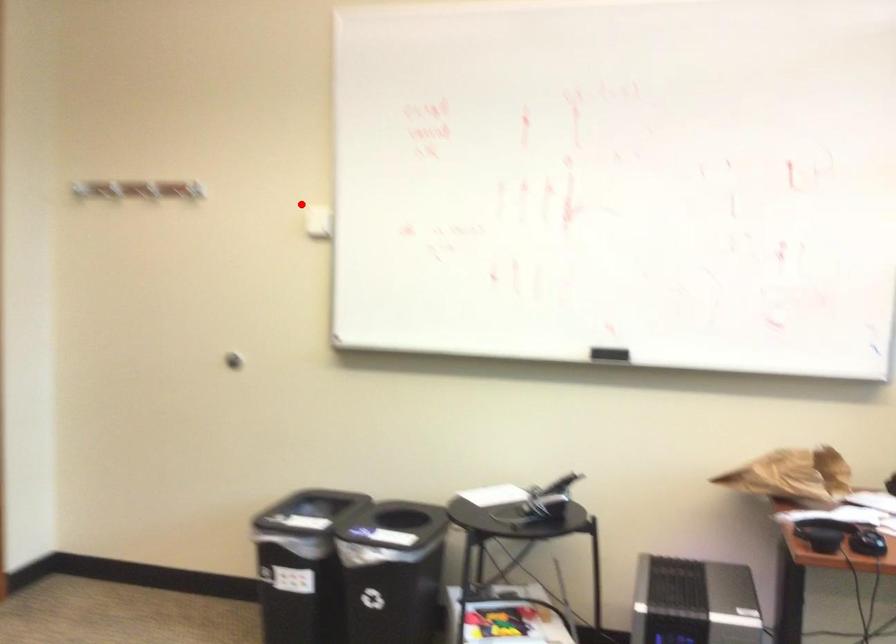
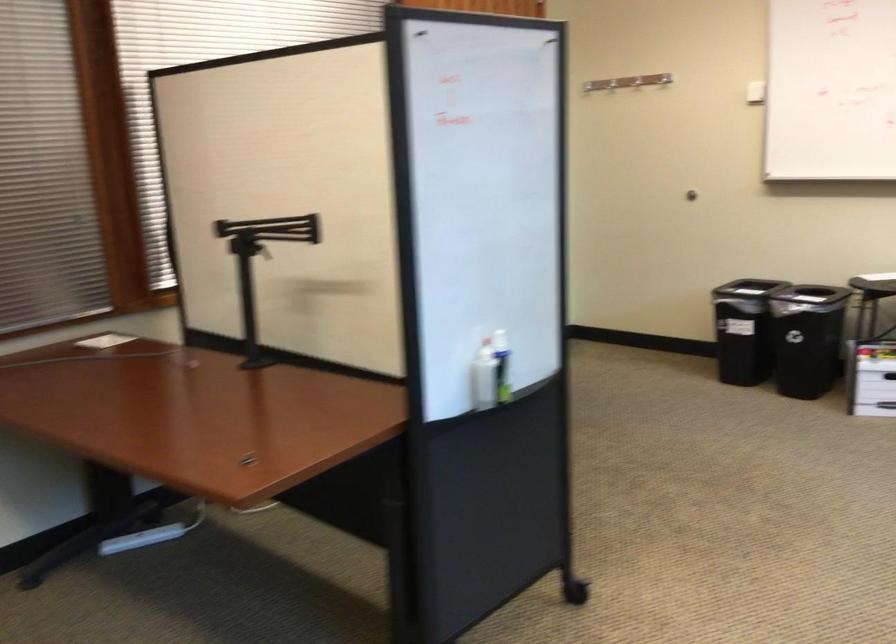
Question: I am providing you with two images of the same scene from different viewpoints. A red point is marked on the first image. At the location where the point appears in image 1, is it still visible in image 2?

Choices:
 (A) Yes
 (B) No

Answer: (A)